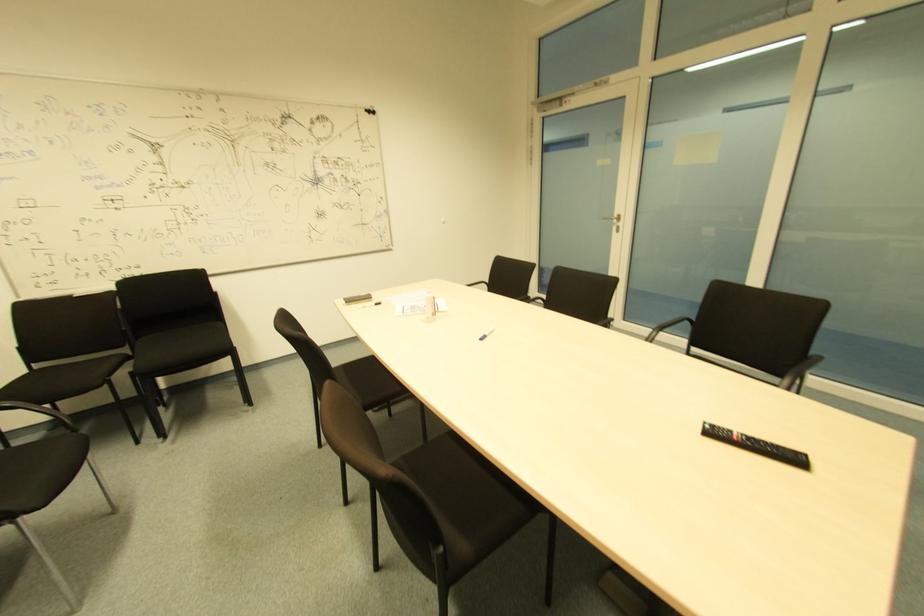
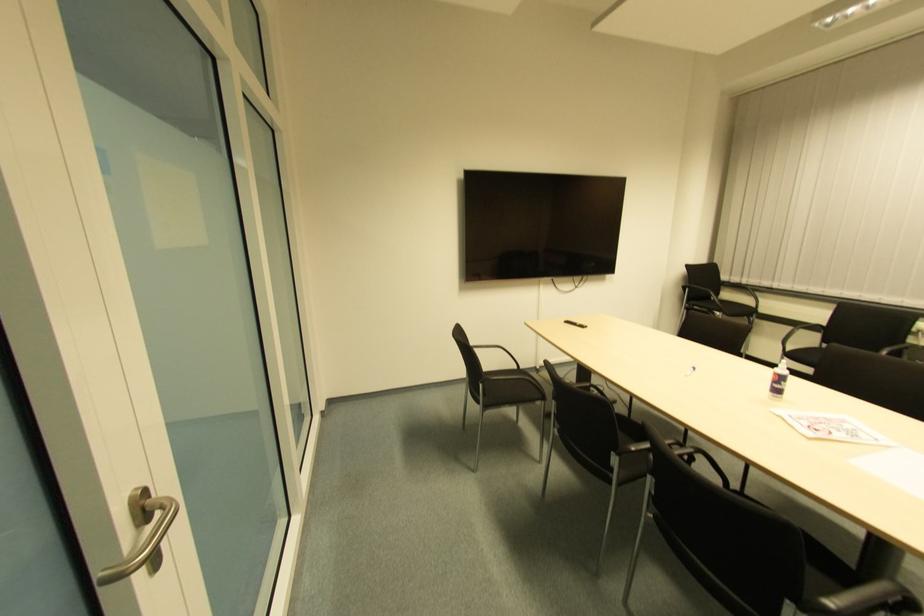
The point at (480, 342) is marked in the first image. Where is the corresponding point in the second image?

(691, 371)